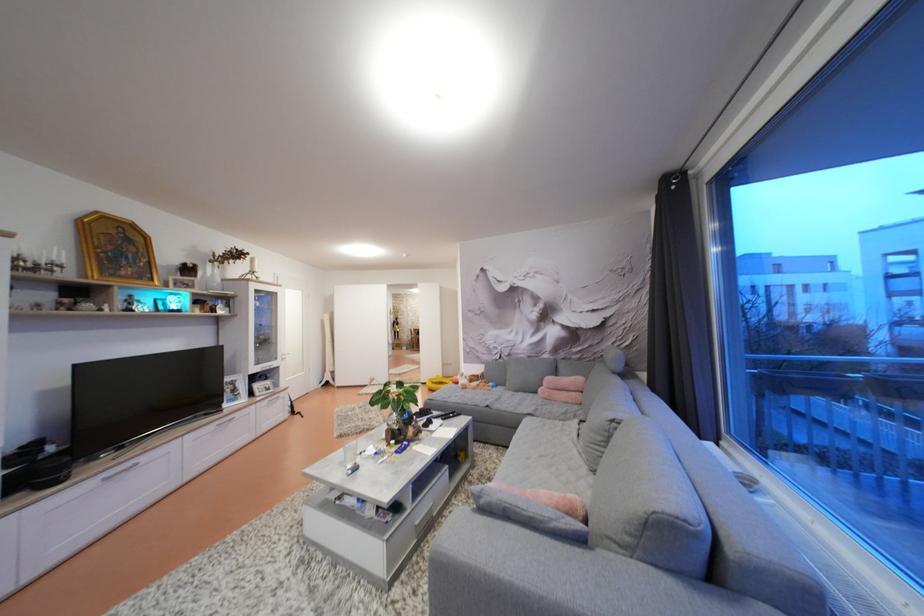
Where would you pull the silver cabinet handle? Please return your answer as a coordinate pair (x, y).

(119, 471)